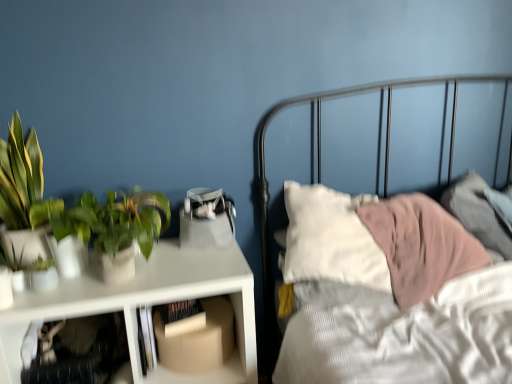
Question: Is translucent plastic shelf at lower left, acting as the 2th shelf starting from the right, bigger than white matte table at left?

Choices:
 (A) yes
 (B) no

Answer: (B)

Question: Is translucent plastic shelf at lower left, the first shelf when ordered from left to right, further to camera compared to white matte table at left?

Choices:
 (A) no
 (B) yes

Answer: (A)

Question: From the image's perspective, is translucent plastic shelf at lower left, acting as the 2th shelf starting from the right, beneath white matte table at left?

Choices:
 (A) yes
 (B) no

Answer: (B)

Question: Is translucent plastic shelf at lower left, the first shelf when ordered from left to right, facing away from white matte table at left?

Choices:
 (A) yes
 (B) no

Answer: (A)

Question: Considering the relative positions of translucent plastic shelf at lower left, acting as the 2th shelf starting from the right, and white matte table at left in the image provided, is translucent plastic shelf at lower left, acting as the 2th shelf starting from the right, to the right of white matte table at left from the viewer's perspective?

Choices:
 (A) no
 (B) yes

Answer: (A)

Question: Looking at the image, does hardcover book at center seem bigger or smaller compared to translucent plastic shelf at lower left, the first shelf when ordered from left to right?

Choices:
 (A) big
 (B) small

Answer: (B)

Question: Considering the relative positions of hardcover book at center and translucent plastic shelf at lower left, the first shelf when ordered from left to right, in the image provided, is hardcover book at center to the left or to the right of translucent plastic shelf at lower left, the first shelf when ordered from left to right,?

Choices:
 (A) right
 (B) left

Answer: (A)

Question: Considering the positions of point (204, 314) and point (125, 344), is point (204, 314) closer or farther from the camera than point (125, 344)?

Choices:
 (A) farther
 (B) closer

Answer: (A)

Question: Looking at their shapes, would you say hardcover book at center is wider or thinner than translucent plastic shelf at lower left, acting as the 2th shelf starting from the right?

Choices:
 (A) wide
 (B) thin

Answer: (B)

Question: Considering the positions of white matte table at left and green matte plant at left in the image, is white matte table at left taller or shorter than green matte plant at left?

Choices:
 (A) short
 (B) tall

Answer: (B)

Question: Would you say white matte table at left is inside or outside green matte plant at left?

Choices:
 (A) inside
 (B) outside

Answer: (B)

Question: Relative to green matte plant at left, is white matte table at left in front or behind?

Choices:
 (A) front
 (B) behind

Answer: (A)

Question: Considering the positions of point pyautogui.click(x=153, y=264) and point pyautogui.click(x=77, y=215), is point pyautogui.click(x=153, y=264) closer or farther from the camera than point pyautogui.click(x=77, y=215)?

Choices:
 (A) closer
 (B) farther

Answer: (B)

Question: Is translucent plastic shelf at lower left, acting as the 2th shelf starting from the right, spatially inside white matte table at left, or outside of it?

Choices:
 (A) inside
 (B) outside

Answer: (A)

Question: Relative to white matte table at left, is translucent plastic shelf at lower left, acting as the 2th shelf starting from the right, in front or behind?

Choices:
 (A) front
 (B) behind

Answer: (A)